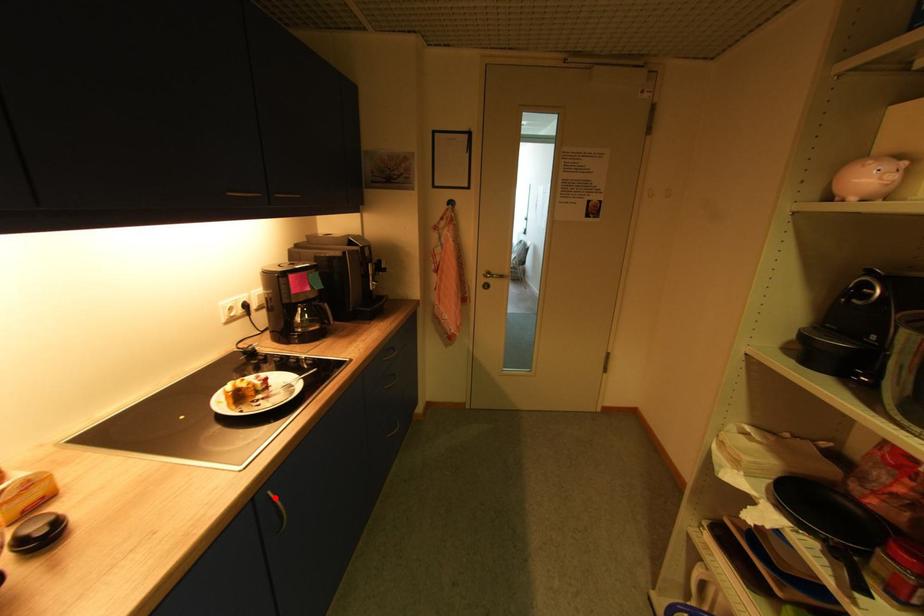
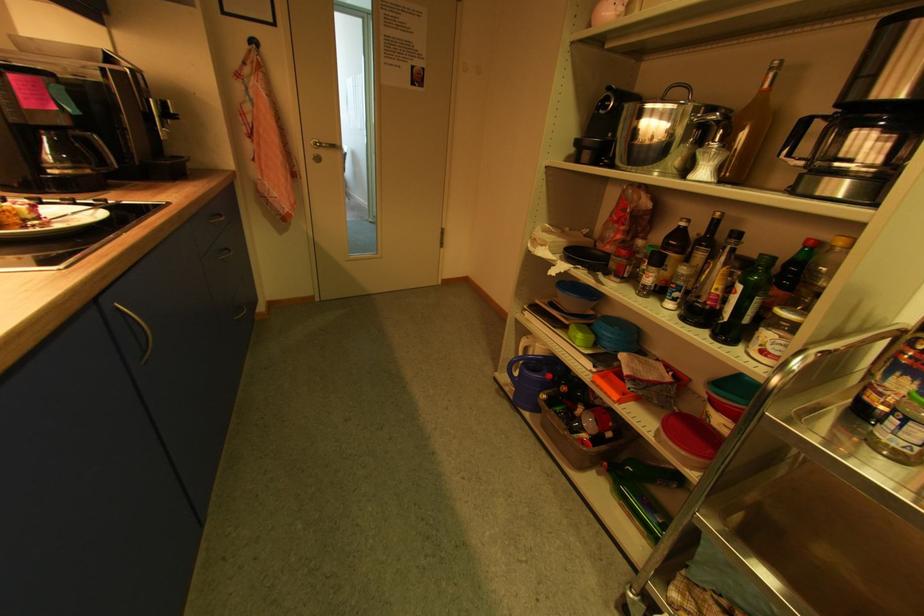
Locate, in the second image, the point that corresponds to the highlighted location in the first image.

(125, 310)